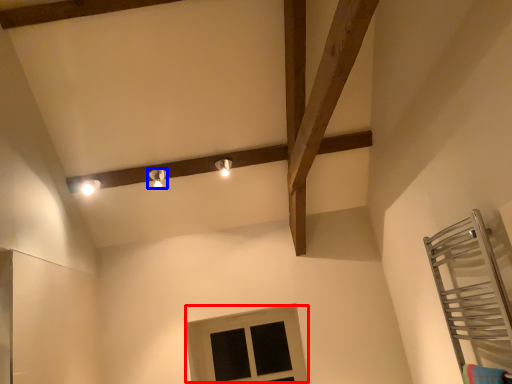
Question: Among these objects, which one is nearest to the camera, window (highlighted by a red box) or light fixture (highlighted by a blue box)?

Choices:
 (A) window
 (B) light fixture

Answer: (B)